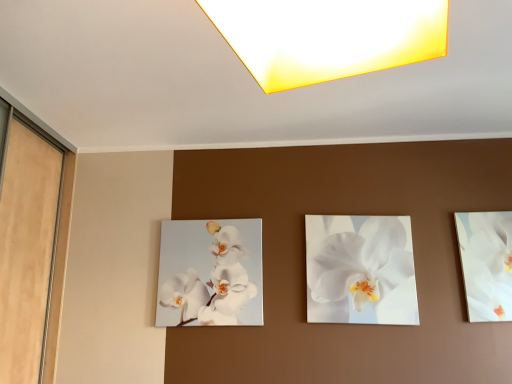
Question: Is white glossy orchid at center, the first flower when ordered from left to right, smaller than matte yellow square at upper center?

Choices:
 (A) no
 (B) yes

Answer: (B)

Question: Could matte yellow square at upper center be considered to be inside white glossy orchid at center, which is counted as the second flower, starting from the right?

Choices:
 (A) no
 (B) yes

Answer: (A)

Question: Would you say white glossy orchid at center, the first flower when ordered from left to right, is outside matte yellow square at upper center?

Choices:
 (A) no
 (B) yes

Answer: (B)

Question: Could you tell me if white glossy orchid at center, which is counted as the second flower, starting from the right, is turned towards matte yellow square at upper center?

Choices:
 (A) no
 (B) yes

Answer: (B)

Question: Is white glossy orchid at center, which is counted as the second flower, starting from the right, to the left of matte yellow square at upper center from the viewer's perspective?

Choices:
 (A) no
 (B) yes

Answer: (B)

Question: Is white glossy orchid at center, which is counted as the second flower, starting from the right, closer to the viewer compared to matte yellow square at upper center?

Choices:
 (A) no
 (B) yes

Answer: (A)

Question: From a real-world perspective, is white glossy orchid at center, the first flower when ordered from left to right, located higher than white glossy orchid at right?

Choices:
 (A) no
 (B) yes

Answer: (A)

Question: Does white glossy orchid at center, the first flower when ordered from left to right, have a larger size compared to white glossy orchid at right?

Choices:
 (A) yes
 (B) no

Answer: (A)

Question: Is white glossy orchid at center, the first flower when ordered from left to right, wider than white glossy orchid at right?

Choices:
 (A) yes
 (B) no

Answer: (B)

Question: Is white glossy orchid at center, the first flower when ordered from left to right, taller than white glossy orchid at right?

Choices:
 (A) no
 (B) yes

Answer: (A)

Question: From the image's perspective, does white glossy orchid at center, the first flower when ordered from left to right, appear lower than white glossy orchid at right?

Choices:
 (A) yes
 (B) no

Answer: (A)

Question: Would you consider white glossy orchid at center, the first flower when ordered from left to right, to be distant from white glossy orchid at right?

Choices:
 (A) yes
 (B) no

Answer: (A)

Question: From a real-world perspective, is matte yellow square at upper center below white glossy orchid at right?

Choices:
 (A) yes
 (B) no

Answer: (B)